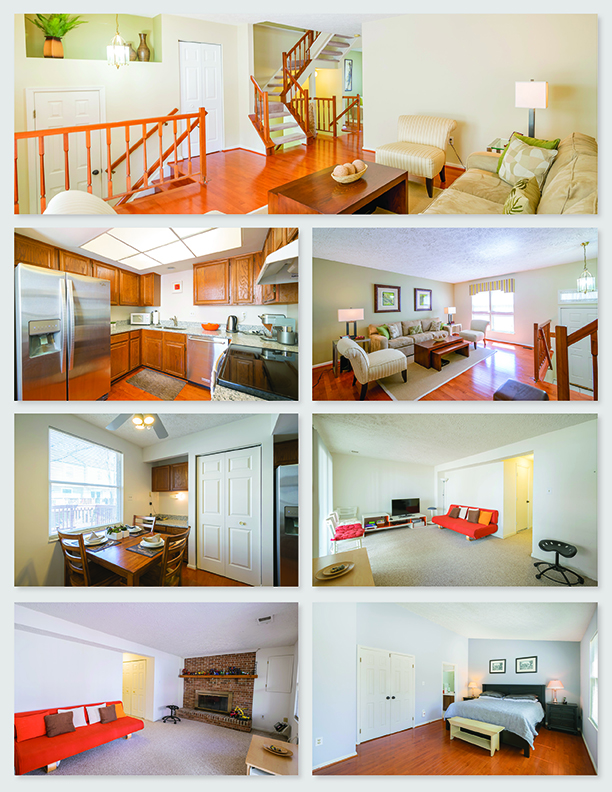
Image resolution: width=612 pixels, height=792 pixels. Identify the location of chairs. (415, 147), (476, 326), (143, 523), (170, 541), (76, 554), (348, 534), (343, 520).